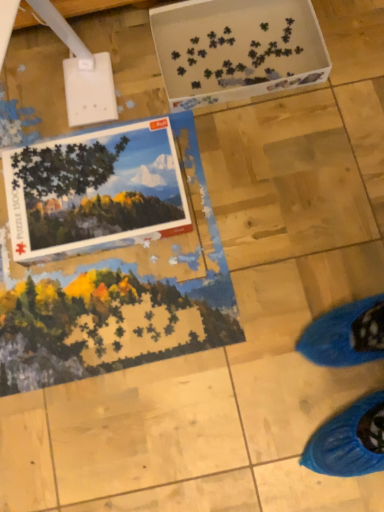
Locate an element on the screen. free location in front of matte cardboard puzzle box at upper left is located at coordinates (118, 302).